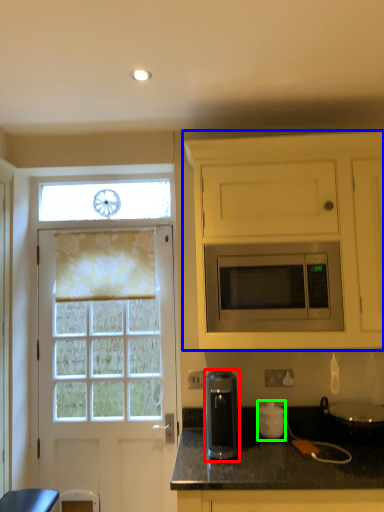
Question: Based on their relative distances, which object is nearer to coffee machine (highlighted by a red box)? Choose from cabinetry (highlighted by a blue box) and appliance (highlighted by a green box).

Choices:
 (A) cabinetry
 (B) appliance

Answer: (B)